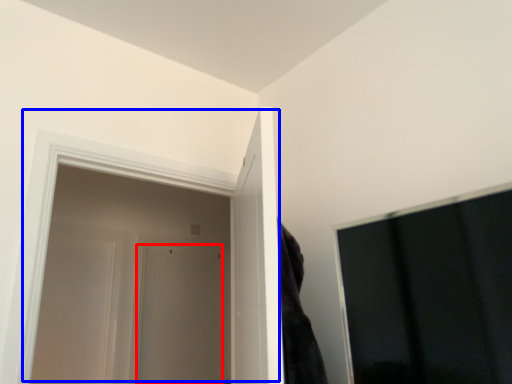
Question: Among these objects, which one is nearest to the camera, door (highlighted by a red box) or door (highlighted by a blue box)?

Choices:
 (A) door
 (B) door

Answer: (B)